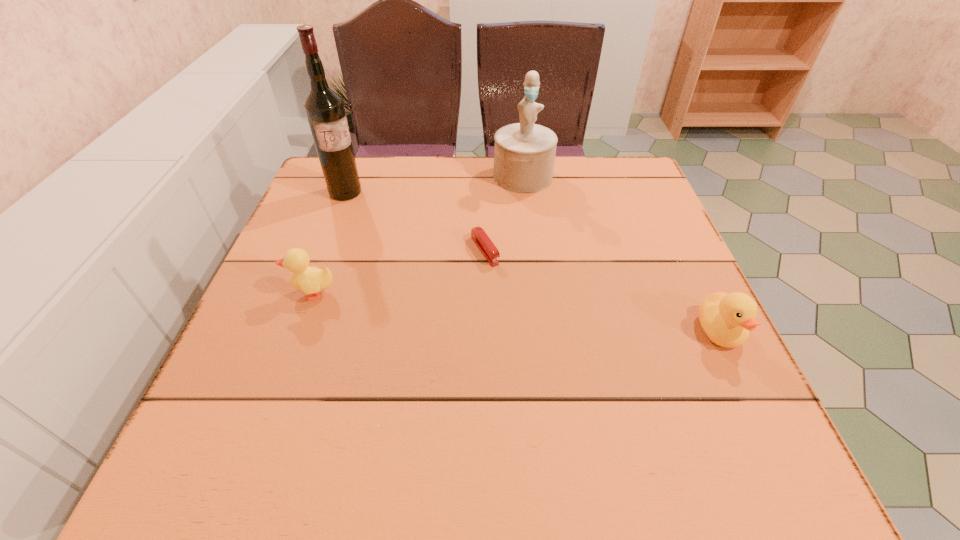
Locate an element on the screen. The height and width of the screenshot is (540, 960). wine bottle present at the left edge is located at coordinates coord(324,108).

Where is `object that is at the right edge`? This screenshot has width=960, height=540. object that is at the right edge is located at coordinates (726, 319).

Locate an element on the screen. Image resolution: width=960 pixels, height=540 pixels. object located at the far left corner is located at coordinates (324, 108).

Where is `free point at the far edge`? The height and width of the screenshot is (540, 960). free point at the far edge is located at coordinates coord(411,180).

You are a GUI agent. You are given a task and a screenshot of the screen. Output one action in this format:
    pyautogui.click(x=<x>, y=<y>)
    Task: Click on the vacant space at the near edge of the desktop
    
    Given the screenshot: What is the action you would take?
    pyautogui.click(x=588, y=383)

Find the location of `free space at the left edge of the desktop`. free space at the left edge of the desktop is located at coordinates (358, 227).

Locate an element on the screen. The image size is (960, 540). free space at the right edge is located at coordinates (695, 357).

In the image, there is a desktop. Where is `vacant space at the far left corner`? vacant space at the far left corner is located at coordinates (333, 204).

Locate an element on the screen. Image resolution: width=960 pixels, height=540 pixels. vacant point at the near left corner is located at coordinates (306, 382).

This screenshot has height=540, width=960. In the image, there is a desktop. What are the coordinates of `free space at the near right corner` in the screenshot? It's located at (702, 416).